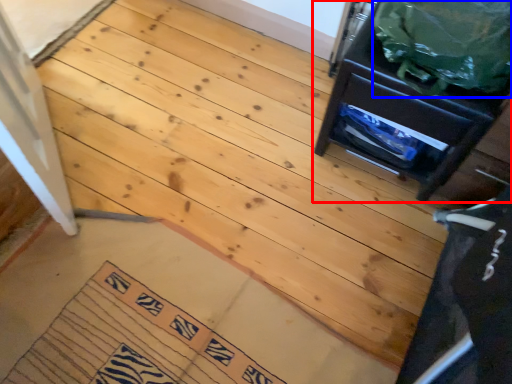
Question: Among these objects, which one is farthest to the camera, furniture (highlighted by a red box) or garbage (highlighted by a blue box)?

Choices:
 (A) furniture
 (B) garbage

Answer: (A)